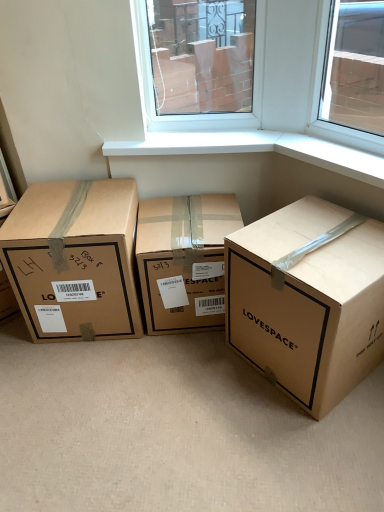
Question: Are brown cardboard box at center, acting as the first box starting from the right, and brown cardboard box at center, the 2th box from the right, far apart?

Choices:
 (A) yes
 (B) no

Answer: (B)

Question: Does brown cardboard box at center, which is the third box in left-to-right order, come in front of brown cardboard box at center, which is counted as the 2th box, starting from the left?

Choices:
 (A) yes
 (B) no

Answer: (A)

Question: Does brown cardboard box at center, which is the third box in left-to-right order, appear on the left side of brown cardboard box at center, the 2th box from the right?

Choices:
 (A) yes
 (B) no

Answer: (B)

Question: Is brown cardboard box at center, acting as the first box starting from the right, not within brown cardboard box at center, the 2th box from the right?

Choices:
 (A) no
 (B) yes

Answer: (B)

Question: From the image's perspective, is brown cardboard box at center, which is the third box in left-to-right order, below brown cardboard box at center, the 2th box from the right?

Choices:
 (A) yes
 (B) no

Answer: (A)

Question: Is point (99, 197) positioned closer to the camera than point (324, 335)?

Choices:
 (A) closer
 (B) farther

Answer: (B)

Question: Based on their sizes in the image, would you say brown cardboard box at left, marked as the third box in a right-to-left arrangement, is bigger or smaller than brown cardboard box at center, acting as the first box starting from the right?

Choices:
 (A) small
 (B) big

Answer: (A)

Question: In the image, is brown cardboard box at left, acting as the first box starting from the left, positioned in front of or behind brown cardboard box at center, which is the third box in left-to-right order?

Choices:
 (A) behind
 (B) front

Answer: (A)

Question: Considering the relative positions of brown cardboard box at left, acting as the first box starting from the left, and brown cardboard box at center, acting as the first box starting from the right, in the image provided, is brown cardboard box at left, acting as the first box starting from the left, to the left or to the right of brown cardboard box at center, acting as the first box starting from the right,?

Choices:
 (A) left
 (B) right

Answer: (A)

Question: Do you think brown cardboard box at center, the 2th box from the right, is within brown cardboard box at center, which is the third box in left-to-right order, or outside of it?

Choices:
 (A) inside
 (B) outside

Answer: (B)

Question: From the image's perspective, is brown cardboard box at center, the 2th box from the right, positioned above or below brown cardboard box at center, which is the third box in left-to-right order?

Choices:
 (A) above
 (B) below

Answer: (A)

Question: In terms of width, does brown cardboard box at center, the 2th box from the right, look wider or thinner when compared to brown cardboard box at center, acting as the first box starting from the right?

Choices:
 (A) wide
 (B) thin

Answer: (B)

Question: Is brown cardboard box at center, which is counted as the 2th box, starting from the left, taller or shorter than brown cardboard box at center, which is the third box in left-to-right order?

Choices:
 (A) short
 (B) tall

Answer: (A)

Question: Considering the positions of brown cardboard box at left, acting as the first box starting from the left, and brown cardboard box at center, which is counted as the 2th box, starting from the left, in the image, is brown cardboard box at left, acting as the first box starting from the left, wider or thinner than brown cardboard box at center, which is counted as the 2th box, starting from the left,?

Choices:
 (A) wide
 (B) thin

Answer: (A)

Question: From a real-world perspective, relative to brown cardboard box at center, which is counted as the 2th box, starting from the left, is brown cardboard box at left, acting as the first box starting from the left, vertically above or below?

Choices:
 (A) below
 (B) above

Answer: (B)